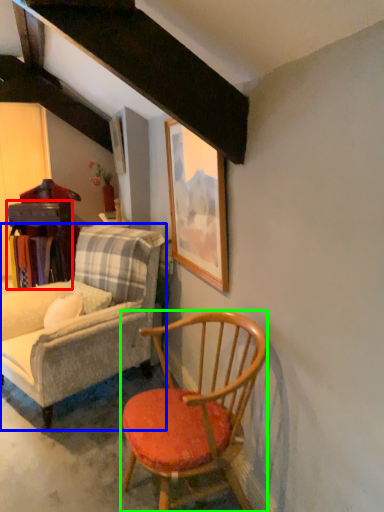
Question: Estimate the real-world distances between objects in this image. Which object is closer to table (highlighted by a red box), chair (highlighted by a blue box) or chair (highlighted by a green box)?

Choices:
 (A) chair
 (B) chair

Answer: (A)